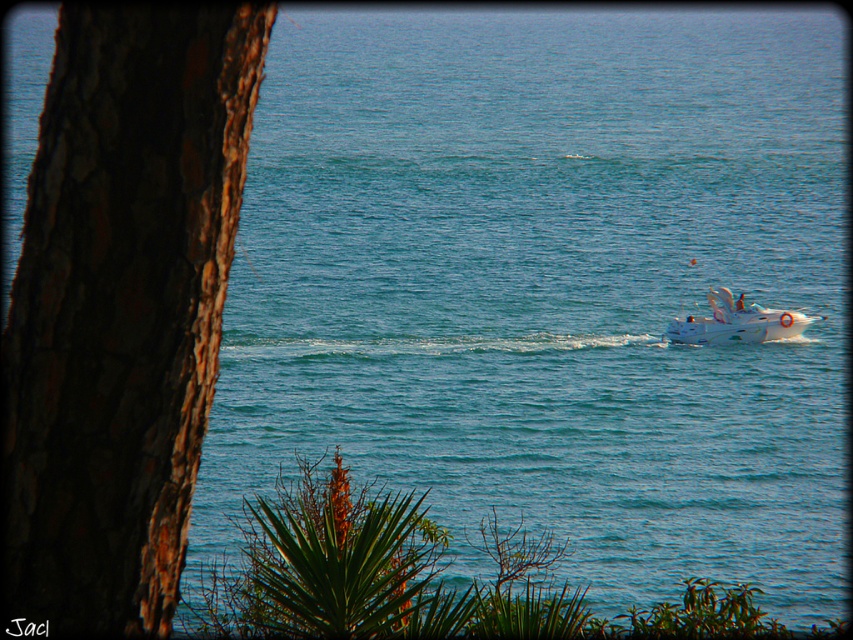
You are standing at the vantage point shown in the image. You want to take a photo that includes both the brown rough bark tree at left and the white glossy boat at right. Which object should you frame first to ensure both are in the shot?

The brown rough bark tree at left is taller than the white glossy boat at right, so you should frame the taller brown rough bark tree at left first to ensure both are in the shot.